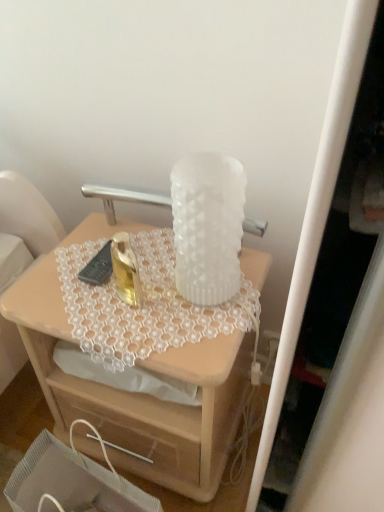
Locate an element on the screen. Image resolution: width=384 pixels, height=512 pixels. vacant space that is to the left of white frosted vase at center is located at coordinates (116, 282).